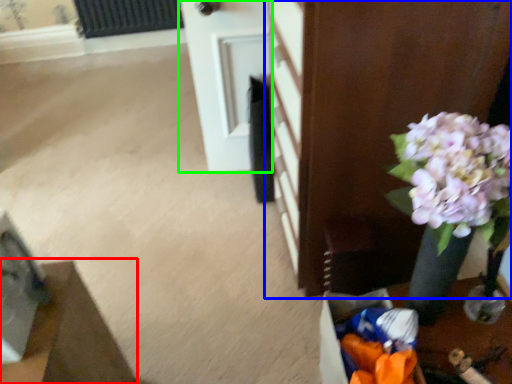
Question: Which is nearer to the furniture (highlighted by a red box)? furniture (highlighted by a blue box) or door (highlighted by a green box).

Choices:
 (A) furniture
 (B) door

Answer: (A)